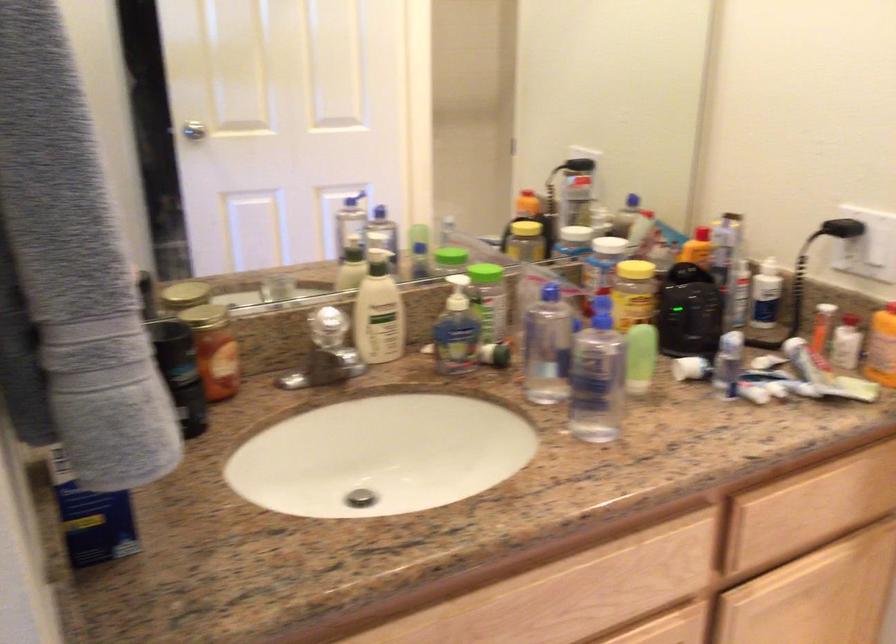
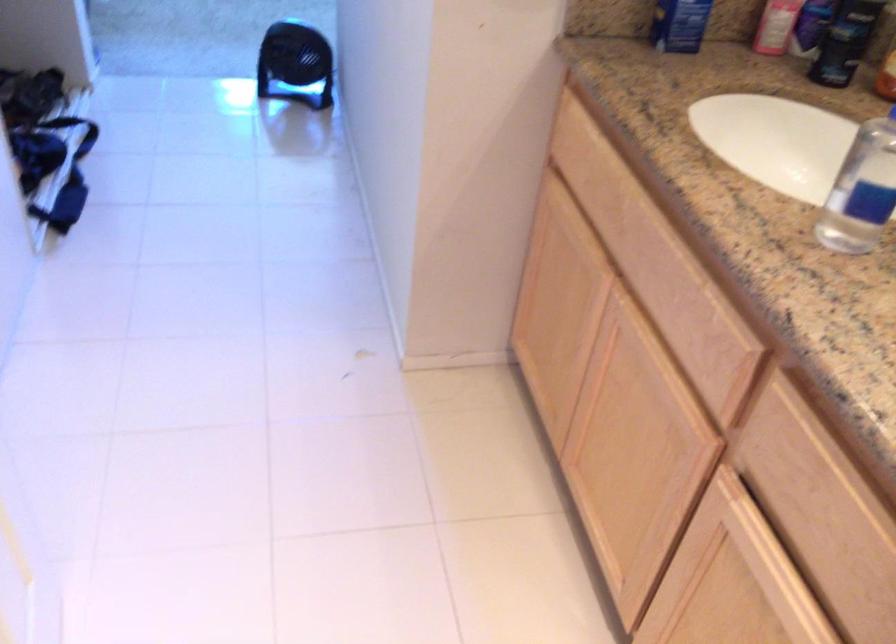
The point at (135, 491) is marked in the first image. Where is the corresponding point in the second image?

(679, 24)